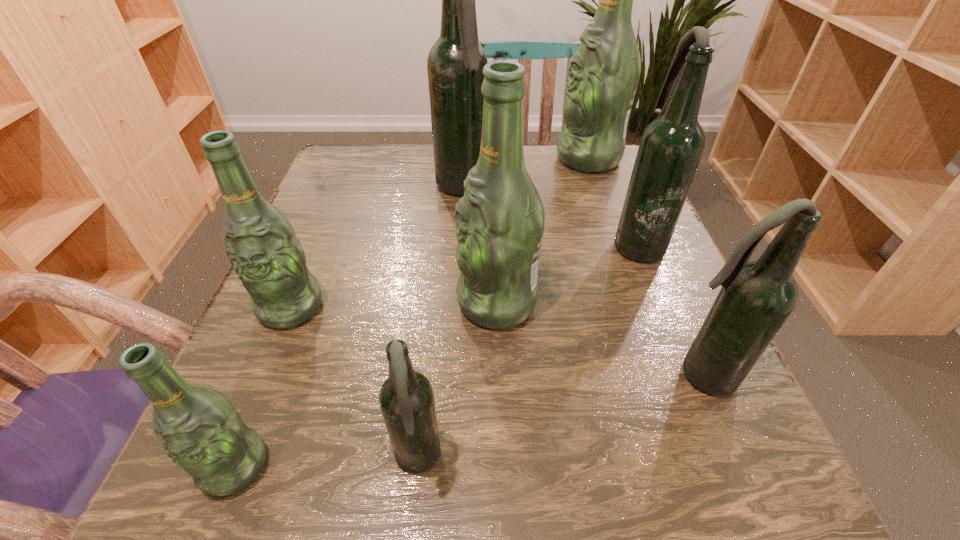
Locate an element on the screen. The height and width of the screenshot is (540, 960). free location located on the back of the third nearest beer bottle is located at coordinates (673, 313).

Where is `vacant space located on the back of the smallest dark beer bottle`? This screenshot has height=540, width=960. vacant space located on the back of the smallest dark beer bottle is located at coordinates (427, 360).

Locate an element on the screen. The image size is (960, 540). object that is at the near left corner is located at coordinates point(199,428).

At what (x,y) coordinates should I click in order to perform the action: click on object located at the far right corner. Please return your answer as a coordinate pair (x, y). Looking at the image, I should click on (602, 79).

Identify the location of blank space at the far edge of the desktop. (554, 145).

In the image, there is a desktop. Where is `free space at the near edge`? free space at the near edge is located at coordinates (425, 477).

I want to click on vacant space at the left edge, so click(290, 356).

The height and width of the screenshot is (540, 960). What are the coordinates of `vacant space at the right edge` in the screenshot? It's located at (612, 212).

The height and width of the screenshot is (540, 960). In the image, there is a desktop. In order to click on free space at the far left corner in this screenshot , I will do [x=321, y=188].

In the image, there is a desktop. Identify the location of blank space at the near left corner. The width and height of the screenshot is (960, 540). (187, 522).